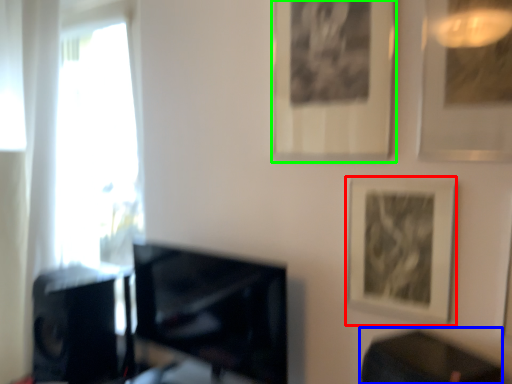
Question: Estimate the real-world distances between objects in this image. Which object is farther from picture frame (highlighted by a red box), table (highlighted by a blue box) or picture frame (highlighted by a green box)?

Choices:
 (A) table
 (B) picture frame

Answer: (B)